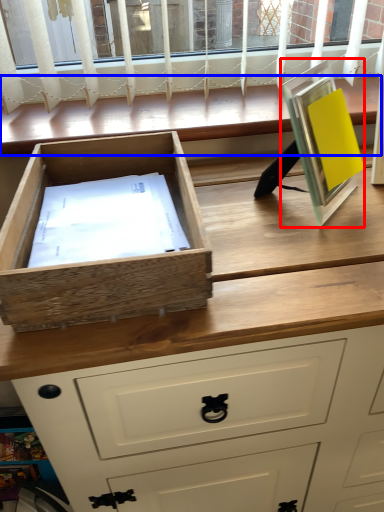
Question: Which of the following is the farthest to the observer, picture frame (highlighted by a red box) or window (highlighted by a blue box)?

Choices:
 (A) picture frame
 (B) window

Answer: (B)